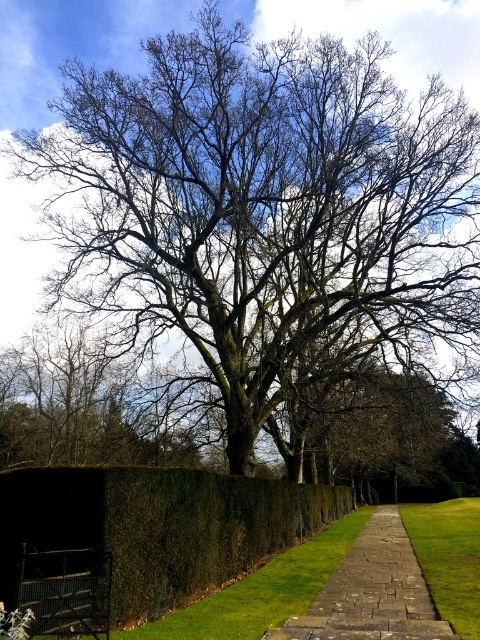
Question: Is the position of brown stone path at center less distant than that of green grass at center?

Choices:
 (A) no
 (B) yes

Answer: (A)

Question: Is green leafy hedge at lower left closer to camera compared to green grass at center?

Choices:
 (A) no
 (B) yes

Answer: (A)

Question: Which point is closer to the camera?

Choices:
 (A) green leafy hedge at lower left
 (B) brown stone path at center

Answer: (B)

Question: Is the position of green leafy hedge at lower left less distant than that of brown stone path at center?

Choices:
 (A) yes
 (B) no

Answer: (B)

Question: Which object is positioned farthest from the green grass at center?

Choices:
 (A) brown stone path at center
 (B) green leafy hedge at lower left

Answer: (B)

Question: Which point is closer to the camera?

Choices:
 (A) (471, 544)
 (B) (420, 611)
 (C) (144, 504)

Answer: (C)